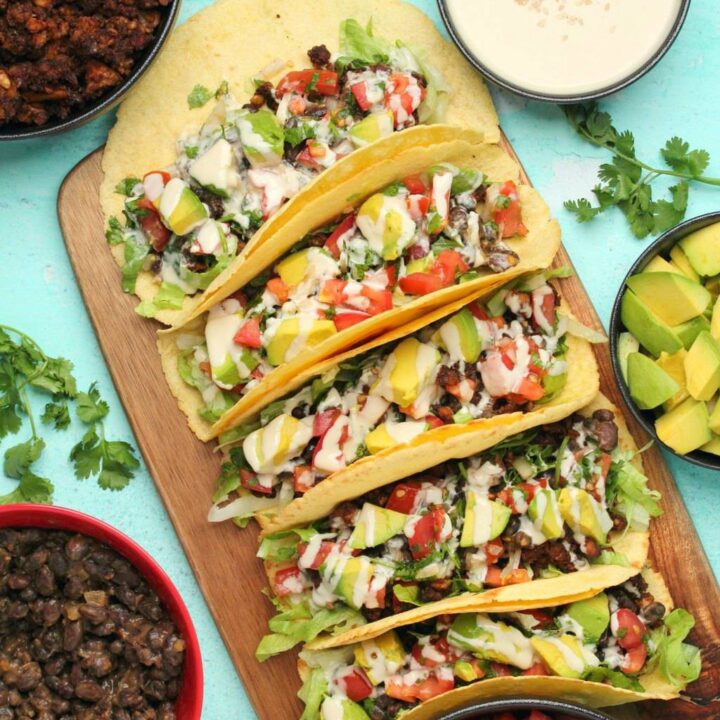
Where is `bowl of meat`? bowl of meat is located at coordinates (62, 36).